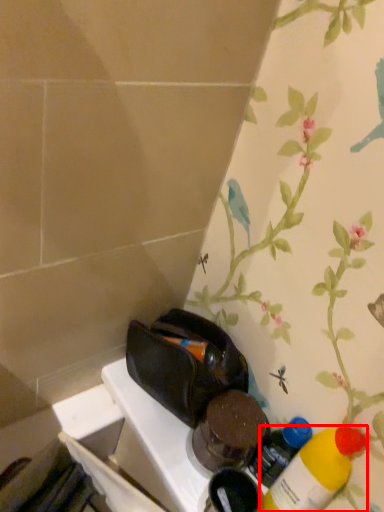
Question: Considering the relative positions of bottle (annotated by the red box) and bottle in the image provided, where is bottle (annotated by the red box) located with respect to the staircase?

Choices:
 (A) right
 (B) left

Answer: (A)